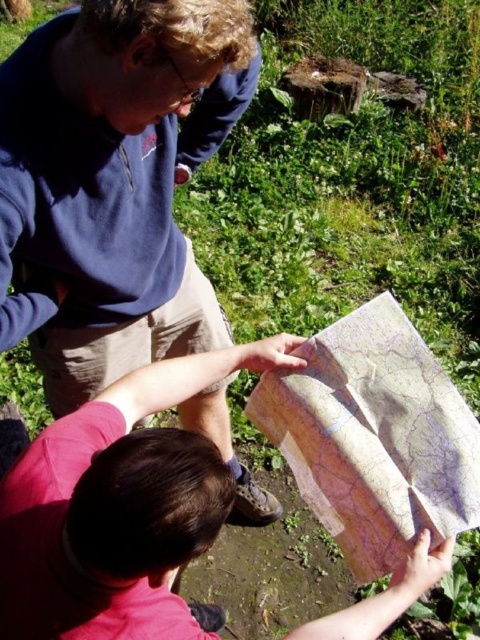
You are a hiker trying to read two maps in the middle of a forest. You have a smooth paper map at center and a beige paper map at center. Which map is more to the left?

→ The smooth paper map at center is positioned on the left side of beige paper map at center, so the smooth paper map at center is more to the left.

You are planning to place a small decorative item on the surface where the blue fleece at upper left and beige paper map at center are located. Which object is taller and would block the view of the other from above?

The blue fleece at upper left is taller than the beige paper map at center, so it would block the view of the beige paper map at center from above.

You are a hiker trying to read the map. Which object is closer to you, the blue fleece at upper left or the smooth paper map at center?

The blue fleece at upper left is closer to you because it is further to the viewer than the smooth paper map at center.